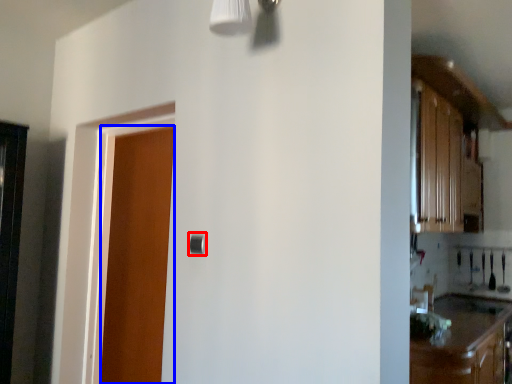
Question: Which of the following is the closest to the observer, door handle (highlighted by a red box) or door (highlighted by a blue box)?

Choices:
 (A) door handle
 (B) door

Answer: (A)